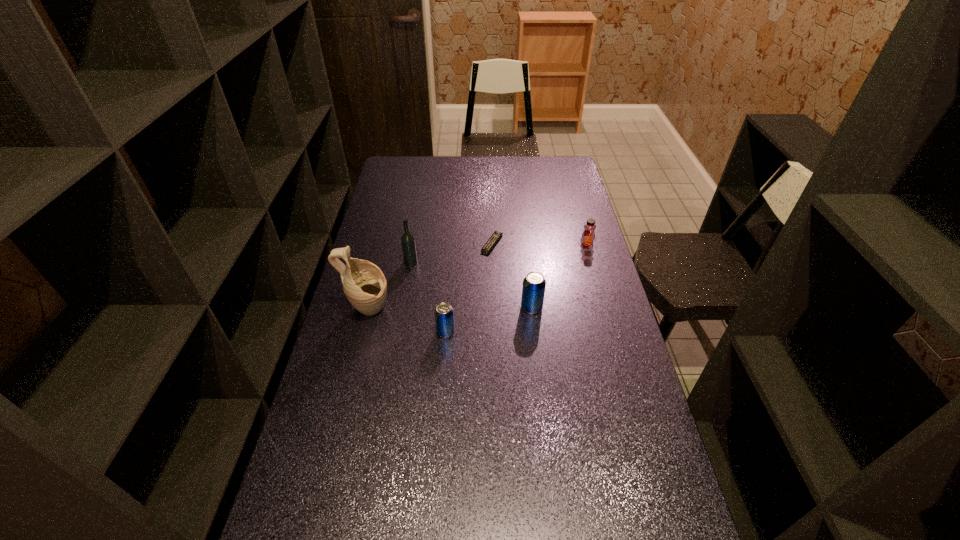
Where is `the rightmost object`? The width and height of the screenshot is (960, 540). the rightmost object is located at coordinates (588, 235).

The height and width of the screenshot is (540, 960). What are the coordinates of `free space located on the back of the shorter beer can` in the screenshot? It's located at (448, 294).

Find the location of a particular element. free space located 0.160m on the back of the right beer can is located at coordinates (527, 268).

You are a GUI agent. You are given a task and a screenshot of the screen. Output one action in this format:
    pyautogui.click(x=<x>, y=<y>)
    Task: Click on the vacant area situated on the right of the shortest object
    This screenshot has width=960, height=540.
    Given the screenshot: What is the action you would take?
    pyautogui.click(x=558, y=244)

Identify the location of vacant point located 0.320m on the back of the fifth object from right to left. (420, 209).

Where is `vacant area situated 0.300m at the spout of the pitcher`? The image size is (960, 540). vacant area situated 0.300m at the spout of the pitcher is located at coordinates (482, 310).

Locate an element on the screen. The width and height of the screenshot is (960, 540). vacant area situated on the front label of the honey is located at coordinates (606, 314).

This screenshot has width=960, height=540. Find the location of `object positioned at the left edge`. object positioned at the left edge is located at coordinates (364, 284).

Where is `object at the right edge`? The width and height of the screenshot is (960, 540). object at the right edge is located at coordinates (588, 235).

Locate an element on the screen. free space at the far edge of the desktop is located at coordinates (523, 181).